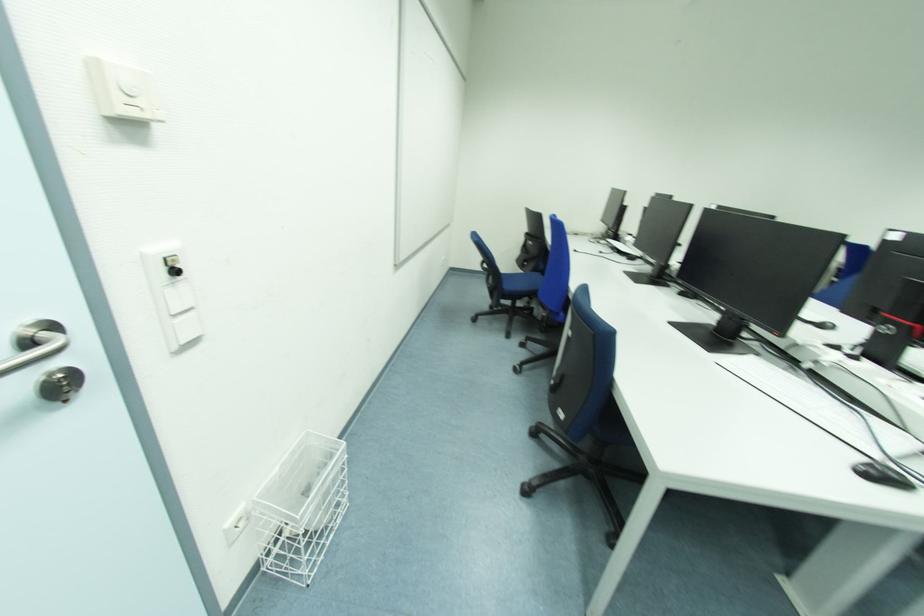
Find where to insert the door lock. Please return your answer as a coordinate pair (x, y).

(61, 384)